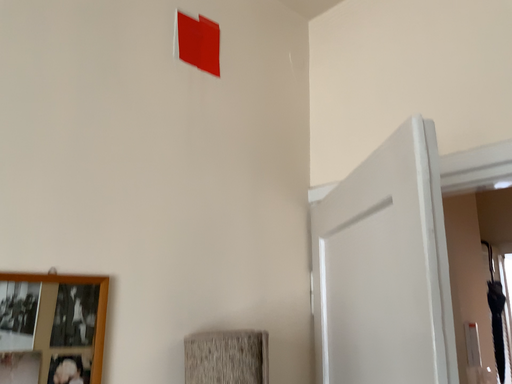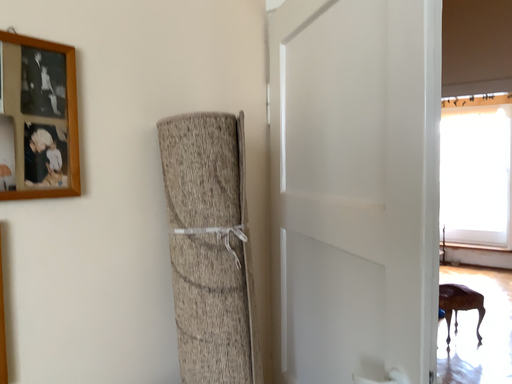
Question: Which way did the camera rotate in the video?

Choices:
 (A) rotated right
 (B) rotated left

Answer: (A)